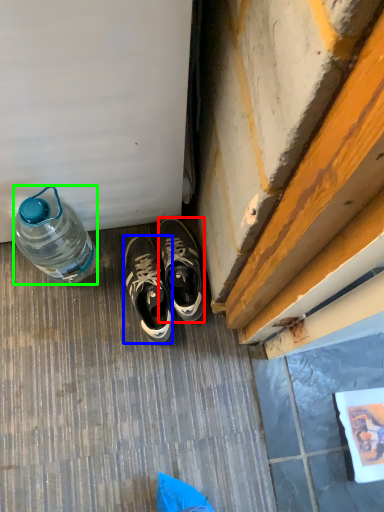
Question: Which object is positioned closest to sneakers (highlighted by a red box)? Select from sneakers (highlighted by a blue box) and bottle (highlighted by a green box).

Choices:
 (A) sneakers
 (B) bottle

Answer: (A)